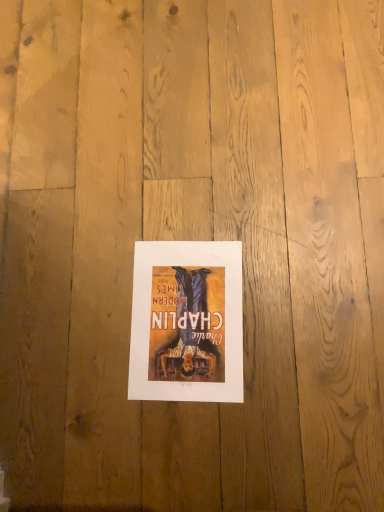
Locate an element on the screen. Image resolution: width=384 pixels, height=512 pixels. vacant space in front of matte paper poster at center is located at coordinates (238, 431).